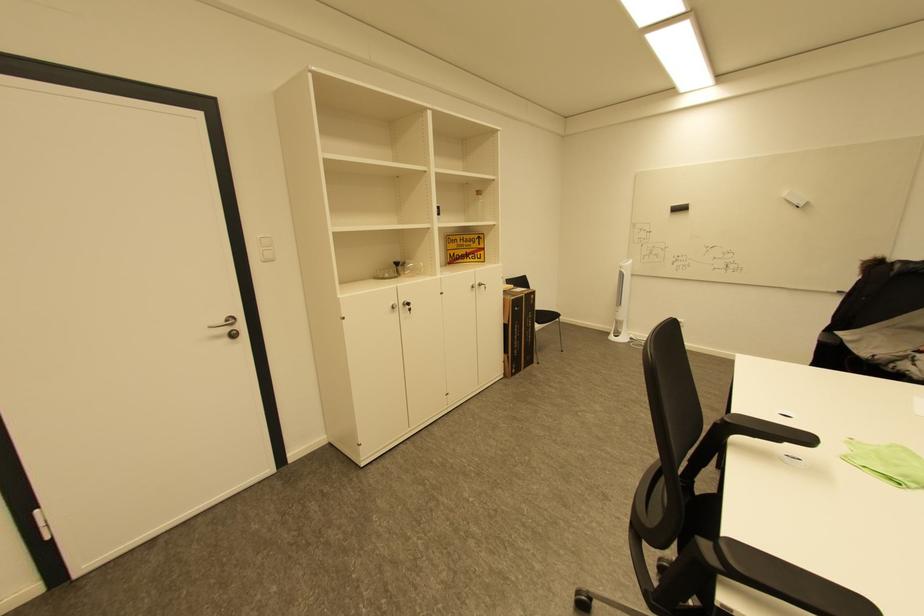
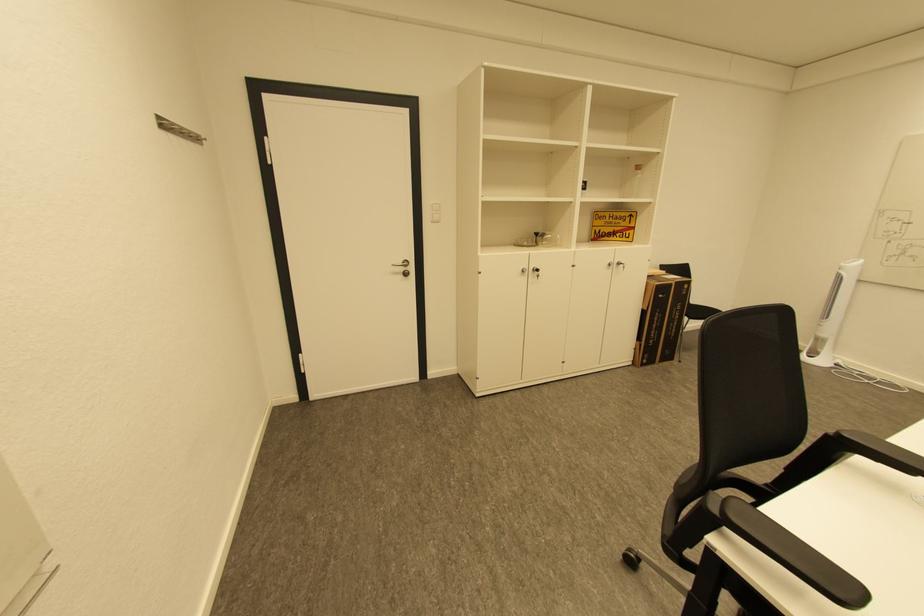
In the second image, find the point that corresponds to (x=458, y=256) in the first image.

(603, 233)